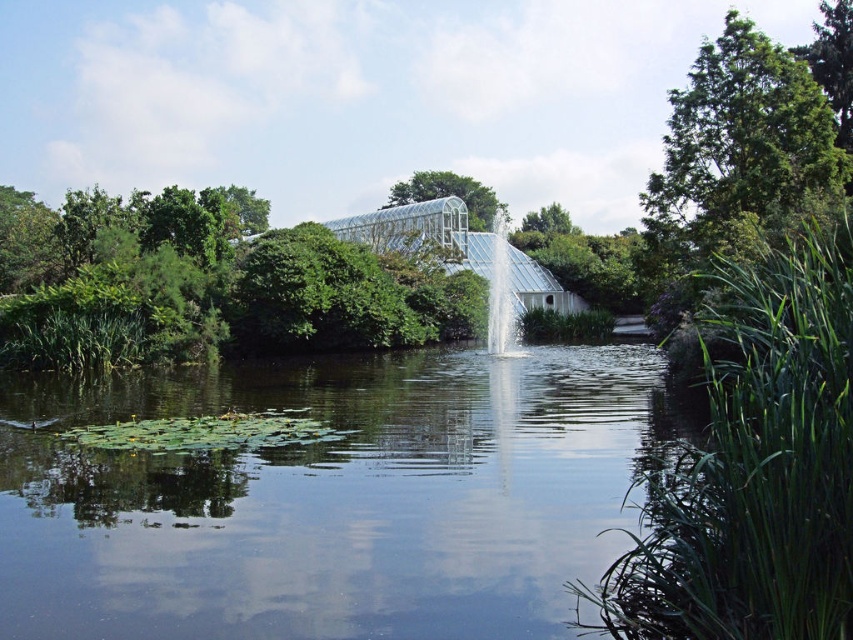
Question: Is clear water at center wider than green leafy reeds at right?

Choices:
 (A) no
 (B) yes

Answer: (B)

Question: Where is green leafy tree at upper right located in relation to clear glass waterfall at center in the image?

Choices:
 (A) right
 (B) left

Answer: (A)

Question: Does clear water at center appear on the left side of green leafy reeds at right?

Choices:
 (A) yes
 (B) no

Answer: (A)

Question: Among these points, which one is nearest to the camera?

Choices:
 (A) (821, 550)
 (B) (503, 332)

Answer: (A)

Question: Which point is farther to the camera?

Choices:
 (A) (312, 572)
 (B) (849, 332)

Answer: (A)

Question: Among these points, which one is farthest from the camera?

Choices:
 (A) (531, 531)
 (B) (694, 509)

Answer: (A)